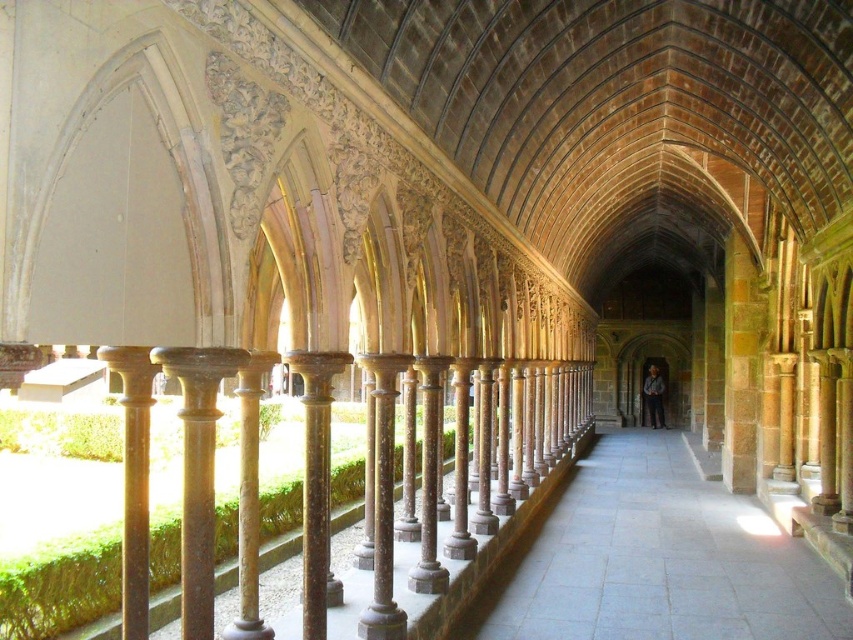
Can you confirm if brown polished stone pillar at left is taller than wooden figure at center?

No, brown polished stone pillar at left is not taller than wooden figure at center.

Who is positioned more to the right, brown polished stone pillar at left or wooden figure at center?

Positioned to the right is wooden figure at center.

The height and width of the screenshot is (640, 853). What do you see at coordinates (134, 481) in the screenshot? I see `brown polished stone pillar at left` at bounding box center [134, 481].

Where is `brown polished stone pillar at left`? The width and height of the screenshot is (853, 640). brown polished stone pillar at left is located at coordinates (134, 481).

Identify the location of gray stone path at center. This screenshot has width=853, height=640. (656, 560).

Between point (755, 609) and point (659, 419), which one is positioned behind?

The point (659, 419) is behind.

Is point (836, 627) positioned before point (657, 403)?

Yes, it is in front of point (657, 403).

Identify the location of gray stone path at center. Image resolution: width=853 pixels, height=640 pixels. (656, 560).

Who is more forward, (601, 612) or (135, 451)?

Point (135, 451) is in front.

Looking at this image, how much distance is there between gray stone path at center and brown polished stone pillar at left?

gray stone path at center is 17.80 meters from brown polished stone pillar at left.

Who is more forward, (624, 547) or (126, 604)?

Point (126, 604)

At what (x,y) coordinates should I click in order to perform the action: click on gray stone path at center. Please return your answer as a coordinate pair (x, y). The height and width of the screenshot is (640, 853). Looking at the image, I should click on (656, 560).